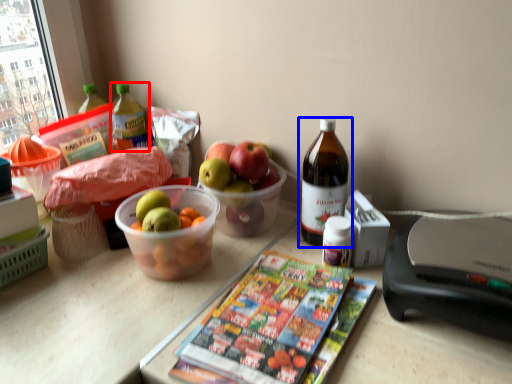
Question: Which point is closer to the camera, bottle (highlighted by a red box) or bottle (highlighted by a blue box)?

Choices:
 (A) bottle
 (B) bottle

Answer: (B)